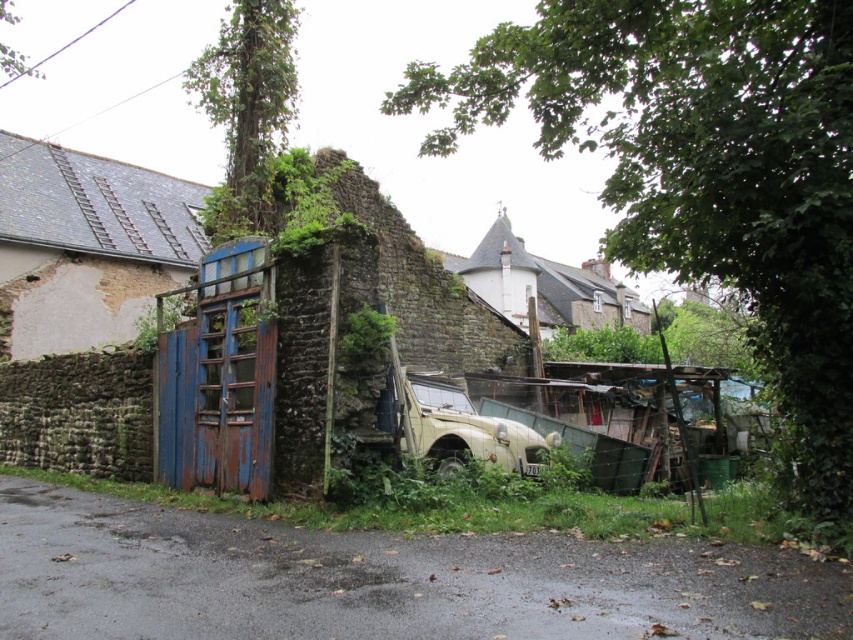
You are a delivery person who needs to park your 10 feet long truck between the green matte car at center and the green leafy weed at center. Is there enough space for your truck to fit between them?

The distance between the green matte car at center and the green leafy weed at center is 8.30 feet, which is shorter than the truck length of 10 feet. Therefore, the truck cannot fit between them.

You are standing at the blue wooden gate and want to walk to the vintage car parked near the debris. There are two points marked on the ground as you walk towards the car. Which point, point 1 at coordinates (486,428) or point 2 at (372,324), will you step on first?

Point 2 at coordinates (372,324) will be stepped on first because it is in front of point 1 at (486,428) according to their spatial relationship.